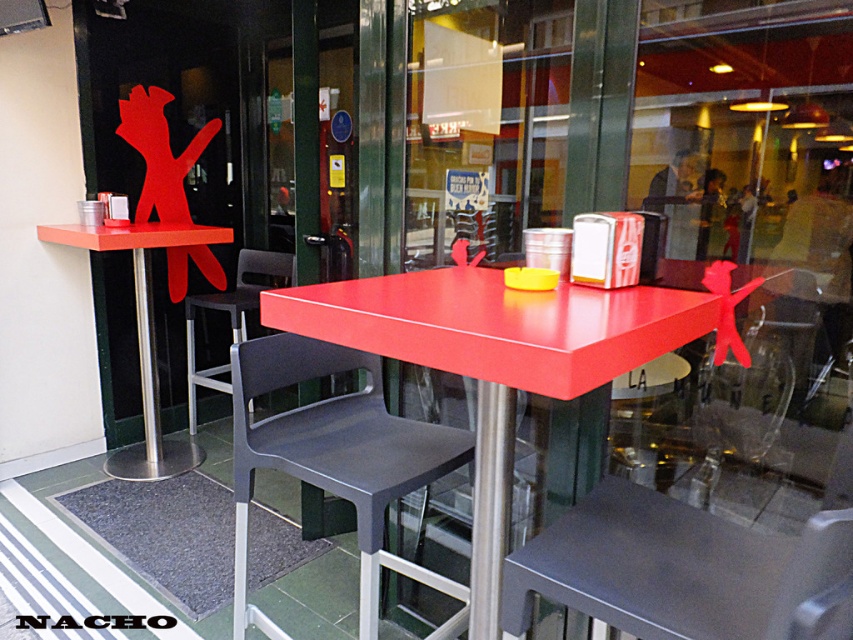
Question: Does matte red table at center appear on the left side of metallic gray chair at lower center?

Choices:
 (A) no
 (B) yes

Answer: (B)

Question: Considering the relative positions of matte red table at center and matte red table at left in the image provided, where is matte red table at center located with respect to matte red table at left?

Choices:
 (A) right
 (B) left

Answer: (A)

Question: Estimate the real-world distances between objects in this image. Which object is farther from the matte red table at center?

Choices:
 (A) matte black chair at center
 (B) matte red table at left
 (C) metallic gray chair at lower center
 (D) black plastic chair at center

Answer: (D)

Question: Which object appears closest to the camera in this image?

Choices:
 (A) matte red table at center
 (B) matte red table at left
 (C) black plastic chair at center

Answer: (A)

Question: Which point is farther to the camera?

Choices:
 (A) matte red table at left
 (B) metallic gray chair at lower center
 (C) matte red table at center
 (D) black plastic chair at center

Answer: (D)

Question: Is matte black chair at center thinner than matte red table at left?

Choices:
 (A) no
 (B) yes

Answer: (B)